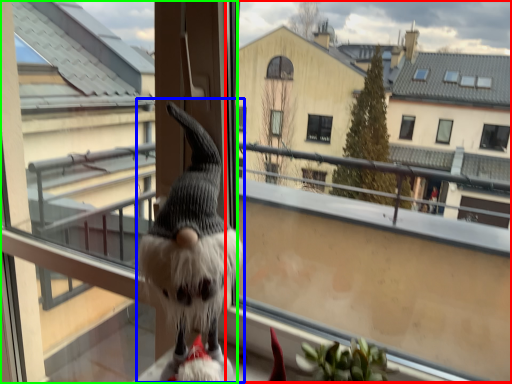
Question: Estimate the real-world distances between objects in this image. Which object is farther from window screen (highlighted by a red box), animal (highlighted by a blue box) or screen door (highlighted by a green box)?

Choices:
 (A) animal
 (B) screen door

Answer: (A)